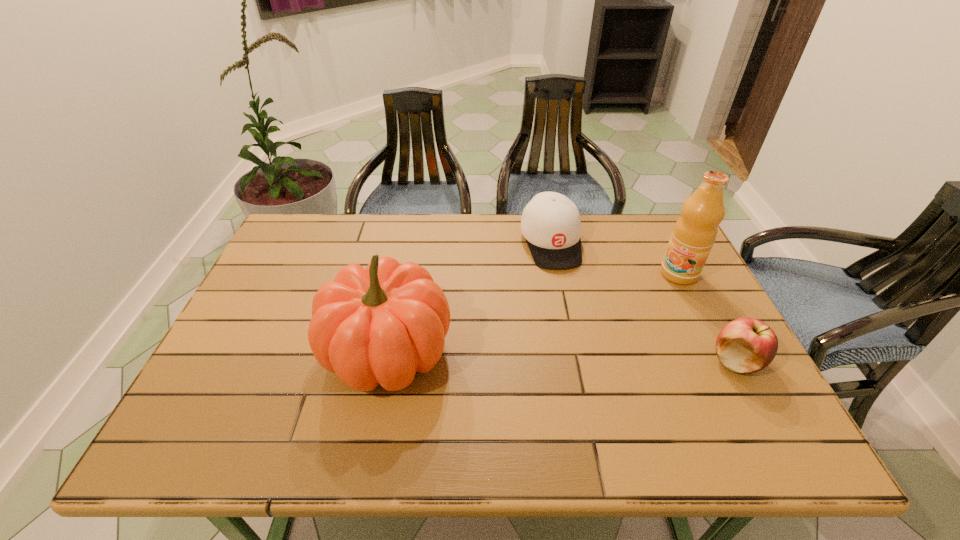
Image resolution: width=960 pixels, height=540 pixels. In the image, there is a desktop. In order to click on vacant area at the far edge in this screenshot , I will do `click(386, 216)`.

The image size is (960, 540). Find the location of `vacant space at the near edge of the desktop`. vacant space at the near edge of the desktop is located at coordinates (336, 396).

In the image, there is a desktop. Where is `vacant area at the left edge`? Image resolution: width=960 pixels, height=540 pixels. vacant area at the left edge is located at coordinates (312, 270).

Identify the location of vacant space at the far left corner of the desktop. This screenshot has height=540, width=960. (297, 232).

This screenshot has height=540, width=960. Identify the location of free space between the pumpkin and the second object from left to right. (469, 298).

This screenshot has height=540, width=960. I want to click on vacant space in between the leftmost object and the fruit juice, so click(533, 313).

Where is `free spot between the apple and the leftmost object`? free spot between the apple and the leftmost object is located at coordinates (562, 356).

At what (x,y) coordinates should I click in order to perform the action: click on empty space between the fruit juice and the apple. Please return your answer as a coordinate pair (x, y). Looking at the image, I should click on (708, 318).

In order to click on empty space between the fruit juice and the leftmost object in this screenshot , I will do `click(533, 313)`.

At what (x,y) coordinates should I click in order to perform the action: click on free space between the baseball cap and the apple. Please return your answer as a coordinate pair (x, y). The height and width of the screenshot is (540, 960). Looking at the image, I should click on (643, 302).